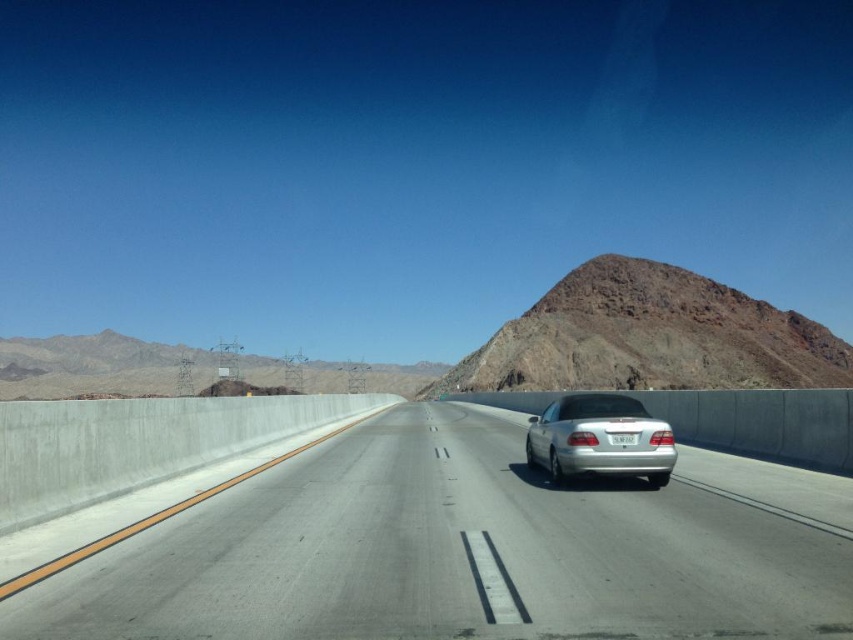
You are a hiker planning to take a photo of both the rugged brown rock at upper right and the rugged rock mountain at upper center. You have a camera with a 50mm lens. Considering the distance between them, will you be able to frame both in a single shot without moving your position?

The rugged brown rock at upper right is 70.55 meters away from the rugged rock mountain at upper center. With a 50mm lens, capturing both in a single frame without moving depends on your distance from them. If you are far enough back, the 50mm lens might allow both to fit, but if you are closer, they might be too spread out. However, since the question doesn

You are driving a car and see the rugged rock mountain at upper center and the silver metallic sedan at center from your current position. Which object is closer to you?

The rugged rock mountain at upper center is closer to you because the silver metallic sedan at center is behind it.

You are standing at the starting point and want to reach the destination. The path goes through two points marked as point 1 at coordinates point (700,296) and point 2 at coordinates point (660,483). Which point should you pass first?

You should pass point 1 at coordinates point (700,296) first because it is closer to you than point 2 at coordinates point (660,483), which is further away.